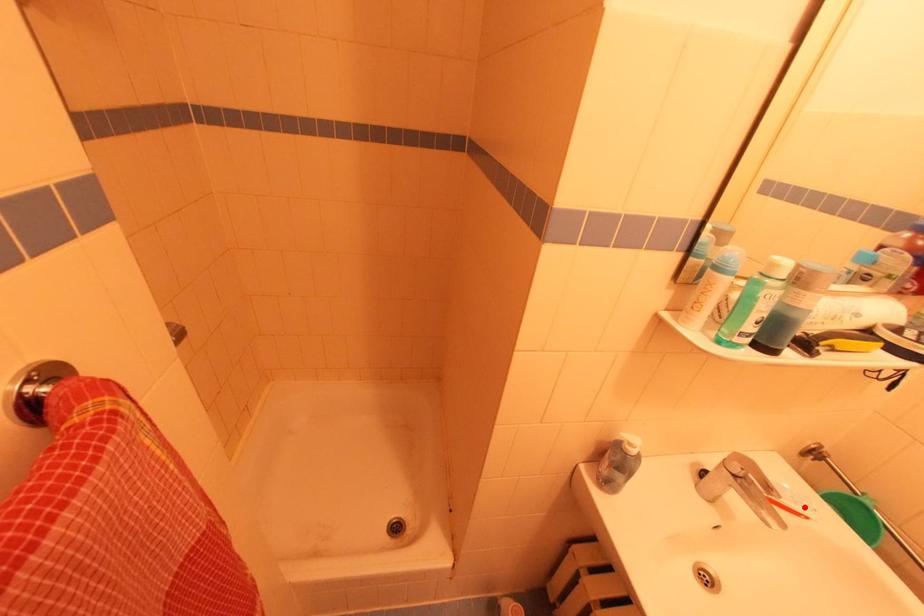
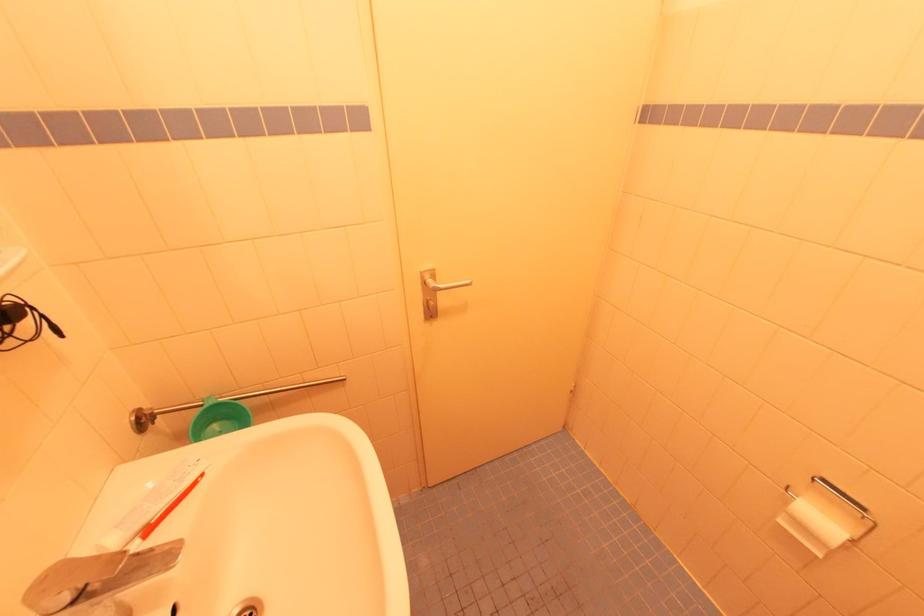
Where in the second image is the point corresponding to the highlighted location from the first image?

(189, 475)